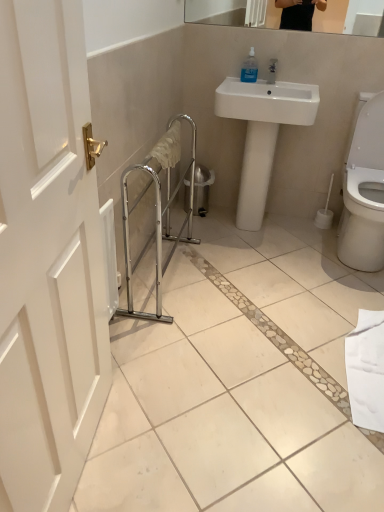
Find the location of a particular element. The image size is (384, 512). white glossy sink at center is located at coordinates (262, 133).

Measure the distance between point (157, 220) and camera.

The depth of point (157, 220) is 2.51 meters.

Identify the location of transparent plastic soap dispenser at upper center. tap(249, 68).

Between point (251, 75) and point (261, 153), which one is positioned behind?

Positioned behind is point (261, 153).

Are transparent plastic soap dispenser at upper center and white glossy sink at center far apart?

transparent plastic soap dispenser at upper center is actually quite close to white glossy sink at center.

Could you tell me if transparent plastic soap dispenser at upper center is facing white glossy sink at center?

Yes, transparent plastic soap dispenser at upper center is aimed at white glossy sink at center.

Does point (291, 117) appear closer or farther from the camera than point (251, 80)?

Point (291, 117) is positioned closer to the camera compared to point (251, 80).

Does white glossy sink at center have a greater width compared to transparent plastic soap dispenser at upper center?

Correct, the width of white glossy sink at center exceeds that of transparent plastic soap dispenser at upper center.

Is white glossy sink at center facing towards transparent plastic soap dispenser at upper center?

No, white glossy sink at center is not turned towards transparent plastic soap dispenser at upper center.

In the scene shown: From the image's perspective, is white glossy sink at center under transparent plastic soap dispenser at upper center?

Yes.

Considering the points (158, 278) and (254, 72), which point is in front, point (158, 278) or point (254, 72)?

The point (158, 278) is in front.

In terms of height, does chrome metallic balustrade at center look taller or shorter compared to transparent plastic soap dispenser at upper center?

In the image, chrome metallic balustrade at center appears to be taller than transparent plastic soap dispenser at upper center.

From a real-world perspective, does chrome metallic balustrade at center stand above transparent plastic soap dispenser at upper center?

No, from a real-world perspective, chrome metallic balustrade at center is not above transparent plastic soap dispenser at upper center.

How different are the orientations of chrome metallic balustrade at center and transparent plastic soap dispenser at upper center in degrees?

There is a 91.1-degree angle between the facing directions of chrome metallic balustrade at center and transparent plastic soap dispenser at upper center.

Between transparent plastic soap dispenser at upper center and chrome metallic balustrade at center, which one has smaller width?

transparent plastic soap dispenser at upper center.

From the image's perspective, is transparent plastic soap dispenser at upper center located above or below chrome metallic balustrade at center?

From the image's perspective, transparent plastic soap dispenser at upper center appears above chrome metallic balustrade at center.

Is there a large distance between transparent plastic soap dispenser at upper center and chrome metallic balustrade at center?

No, transparent plastic soap dispenser at upper center is not far away from chrome metallic balustrade at center.

In terms of height, does transparent plastic soap dispenser at upper center look taller or shorter compared to chrome metallic balustrade at center?

In the image, transparent plastic soap dispenser at upper center appears to be shorter than chrome metallic balustrade at center.

The height and width of the screenshot is (512, 384). In order to click on sink behind the chrome metallic balustrade at center in this screenshot , I will do `click(262, 133)`.

How many degrees apart are the facing directions of white glossy sink at center and chrome metallic balustrade at center?

white glossy sink at center and chrome metallic balustrade at center are facing 92.3 degrees away from each other.

From the image's perspective, between white glossy sink at center and chrome metallic balustrade at center, who is located below?

chrome metallic balustrade at center appears lower in the image.

Is white glossy sink at center touching chrome metallic balustrade at center?

No, white glossy sink at center is not in contact with chrome metallic balustrade at center.

Is chrome metallic balustrade at center to the left or to the right of white glossy sink at center in the image?

chrome metallic balustrade at center is to the left of white glossy sink at center.

From the image's perspective, is chrome metallic balustrade at center on white glossy sink at center?

Actually, chrome metallic balustrade at center appears below white glossy sink at center in the image.

The image size is (384, 512). I want to click on balustrade that appears below the white glossy sink at center (from the image's perspective), so click(157, 224).

Which object is thinner, chrome metallic balustrade at center or white glossy sink at center?

Thinner between the two is chrome metallic balustrade at center.

Image resolution: width=384 pixels, height=512 pixels. What are the coordinates of `sink below the transparent plastic soap dispenser at upper center (from the image's perspective)` in the screenshot? It's located at pyautogui.click(x=262, y=133).

At what (x,y) coordinates should I click in order to perform the action: click on soap dispenser above the white glossy sink at center (from the image's perspective). Please return your answer as a coordinate pair (x, y). The width and height of the screenshot is (384, 512). Looking at the image, I should click on (249, 68).

Estimate the real-world distances between objects in this image. Which object is further from transparent plastic soap dispenser at upper center, chrome metallic balustrade at center or white glossy sink at center?

Among the two, chrome metallic balustrade at center is located further to transparent plastic soap dispenser at upper center.

When comparing their distances from chrome metallic balustrade at center, does transparent plastic soap dispenser at upper center or white glossy sink at center seem closer?

The object closer to chrome metallic balustrade at center is white glossy sink at center.

Based on their spatial positions, is white glossy sink at center or transparent plastic soap dispenser at upper center closer to chrome metallic balustrade at center?

Based on the image, white glossy sink at center appears to be nearer to chrome metallic balustrade at center.

Estimate the real-world distances between objects in this image. Which object is closer to white glossy sink at center, transparent plastic soap dispenser at upper center or chrome metallic balustrade at center?

transparent plastic soap dispenser at upper center is positioned closer to the anchor white glossy sink at center.

When comparing their distances from white glossy sink at center, does chrome metallic balustrade at center or transparent plastic soap dispenser at upper center seem closer?

Among the two, transparent plastic soap dispenser at upper center is located nearer to white glossy sink at center.

Which object lies further to the anchor point transparent plastic soap dispenser at upper center, white glossy sink at center or chrome metallic balustrade at center?

Among the two, chrome metallic balustrade at center is located further to transparent plastic soap dispenser at upper center.

Where is `sink between transparent plastic soap dispenser at upper center and chrome metallic balustrade at center vertically`? sink between transparent plastic soap dispenser at upper center and chrome metallic balustrade at center vertically is located at coordinates click(x=262, y=133).